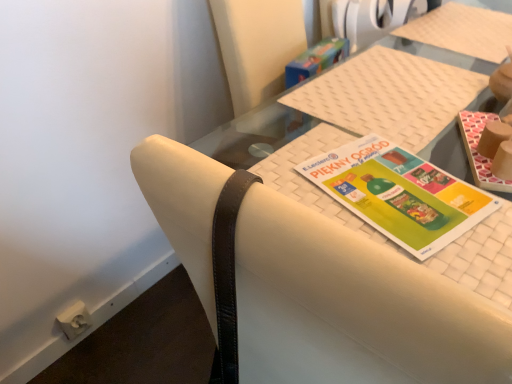
At what (x,y) coordinates should I click in order to perform the action: click on free region on the left part of multicolored paper at center, positioned as the 2th book in right-to-left order. Please return your answer as a coordinate pair (x, y). Looking at the image, I should click on (269, 158).